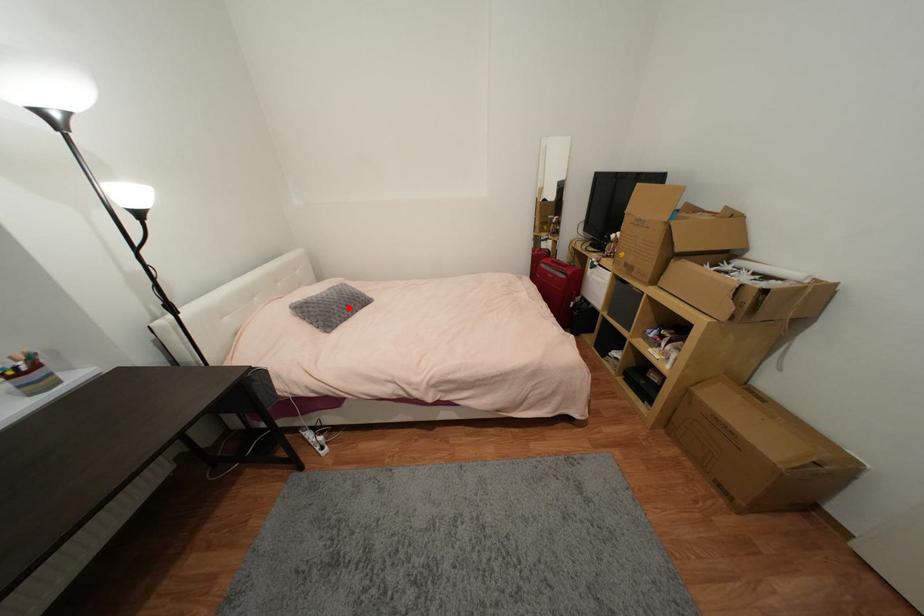
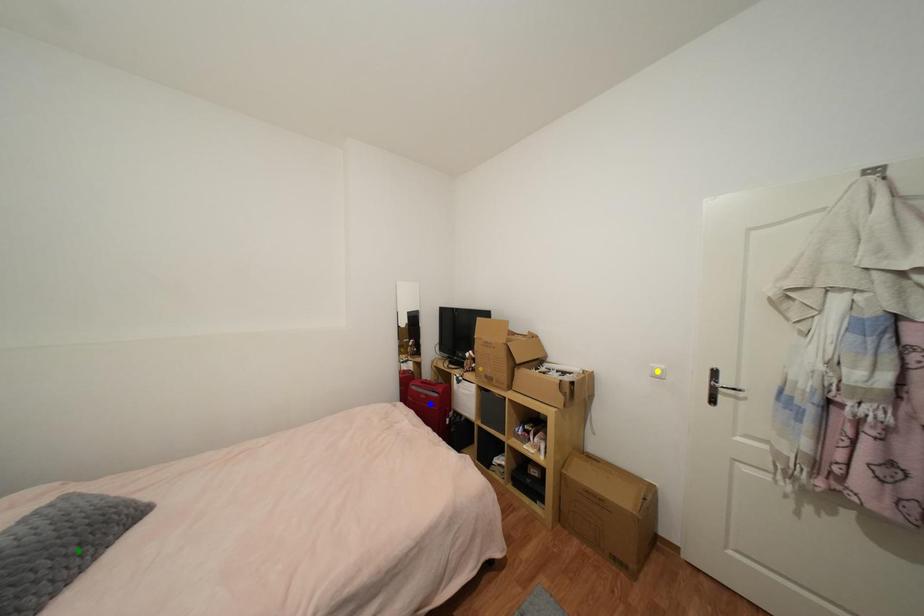
Question: I am providing you with two images of the same scene from different viewpoints. A red point is marked on the first image. You are given multiple points on the second image. In image 2, which mark is for the same physical point as the one in image 1?

Choices:
 (A) yellow point
 (B) blue point
 (C) green point

Answer: (C)